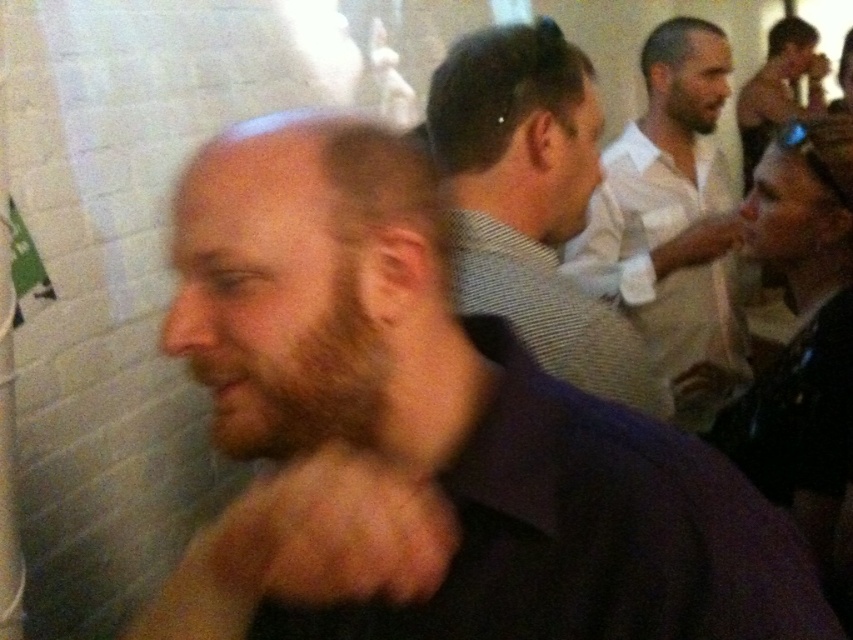
Question: Among these objects, which one is farthest from the camera?

Choices:
 (A) brown beard at center
 (B) checkered shirt at center

Answer: (B)

Question: Which of the following is the closest to the observer?

Choices:
 (A) (802, 52)
 (B) (334, 172)

Answer: (B)

Question: Which point is closer to the camera?

Choices:
 (A) (698, 196)
 (B) (392, 413)
 (C) (780, 20)

Answer: (B)

Question: Can you confirm if brown beard at center is positioned below shiny silver phone at upper right?

Choices:
 (A) no
 (B) yes

Answer: (B)

Question: Does brown beard at center appear on the right side of shiny silver phone at upper right?

Choices:
 (A) yes
 (B) no

Answer: (B)

Question: Does brown beard at center have a greater width compared to checkered shirt at center?

Choices:
 (A) yes
 (B) no

Answer: (A)